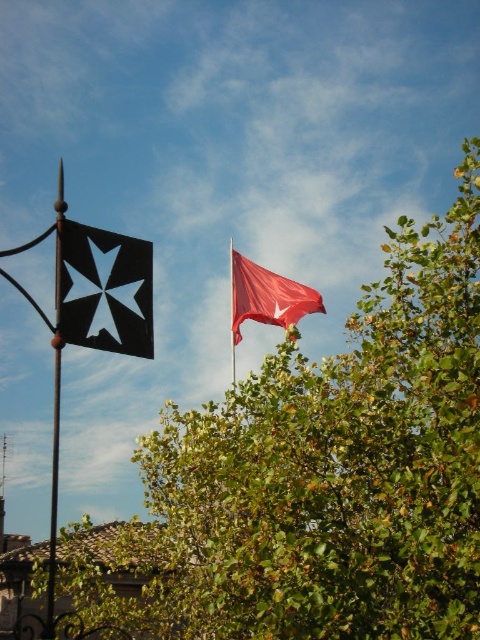
Question: Which point is farther from the camera taking this photo?

Choices:
 (A) (232, 332)
 (B) (108, 236)
 (C) (261, 314)

Answer: (C)

Question: Which point is closer to the camera?

Choices:
 (A) (232, 333)
 (B) (49, 556)

Answer: (B)

Question: Is matte red flag at center thinner than red fabric flag at upper right?

Choices:
 (A) no
 (B) yes

Answer: (A)

Question: From the image, what is the correct spatial relationship of black wrought iron flag pole at left in relation to red fabric flag at upper right?

Choices:
 (A) below
 (B) above

Answer: (A)

Question: Can you confirm if black matte flag at left is positioned below matte red flag at center?

Choices:
 (A) no
 (B) yes

Answer: (A)

Question: Among these objects, which one is nearest to the camera?

Choices:
 (A) green leafy tree at upper center
 (B) red fabric flag at upper right

Answer: (A)